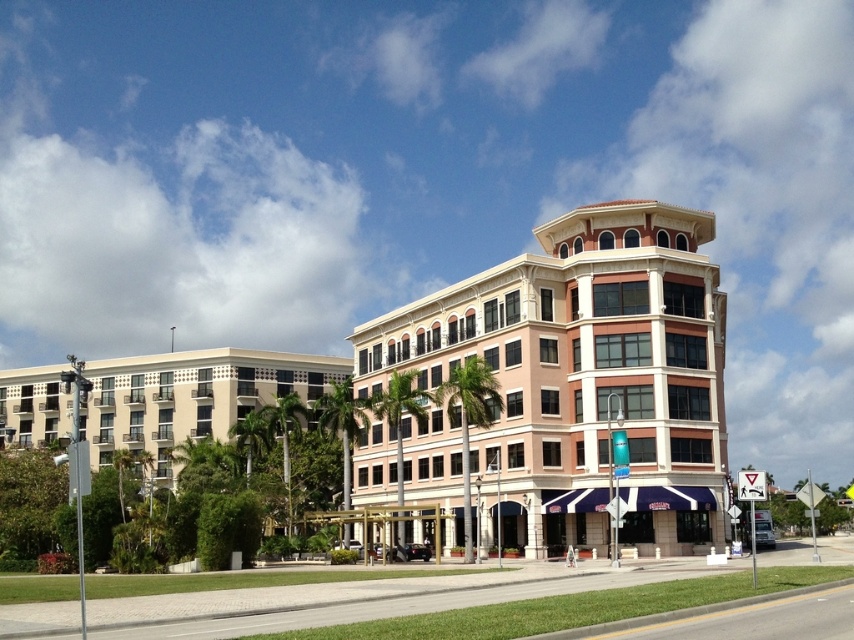
Question: Can you confirm if beige stone building at center is positioned to the right of beige concrete building at left?

Choices:
 (A) yes
 (B) no

Answer: (A)

Question: Can you confirm if beige stone building at center is bigger than beige concrete building at left?

Choices:
 (A) no
 (B) yes

Answer: (A)

Question: Can you confirm if beige stone building at center is smaller than beige concrete building at left?

Choices:
 (A) yes
 (B) no

Answer: (A)

Question: Which point is closer to the camera?

Choices:
 (A) (223, 365)
 (B) (483, 353)

Answer: (B)